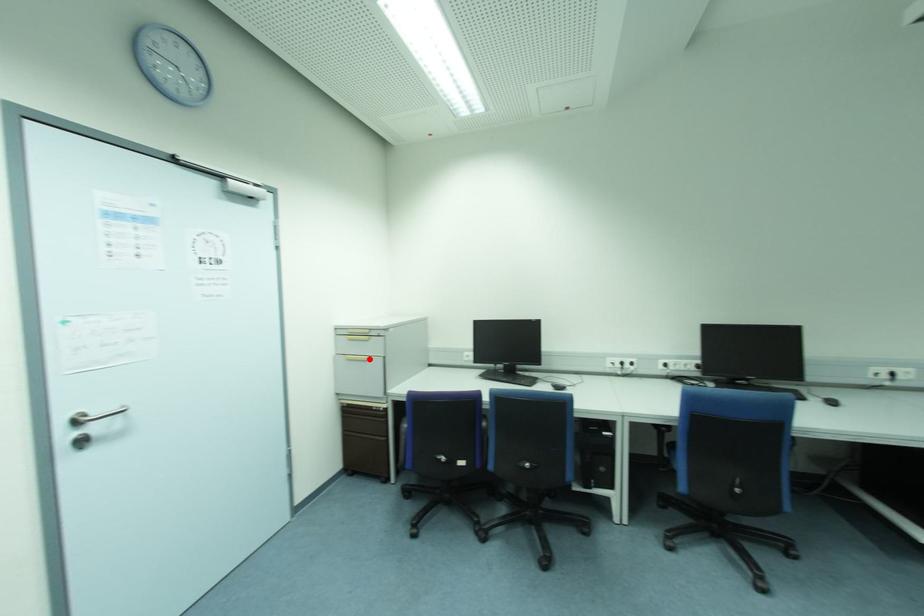
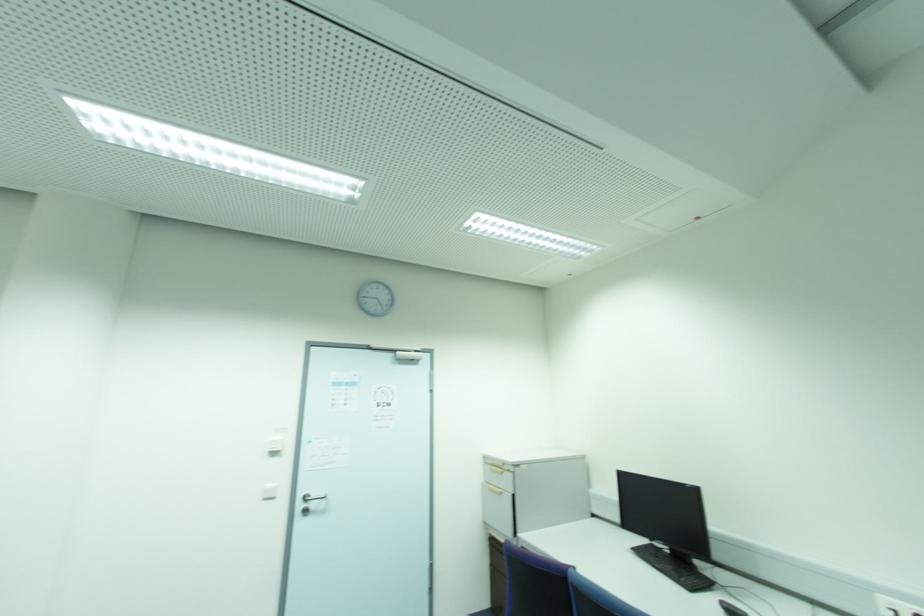
Where in the second image is the point corresponding to the highlighted location from the first image?

(502, 493)